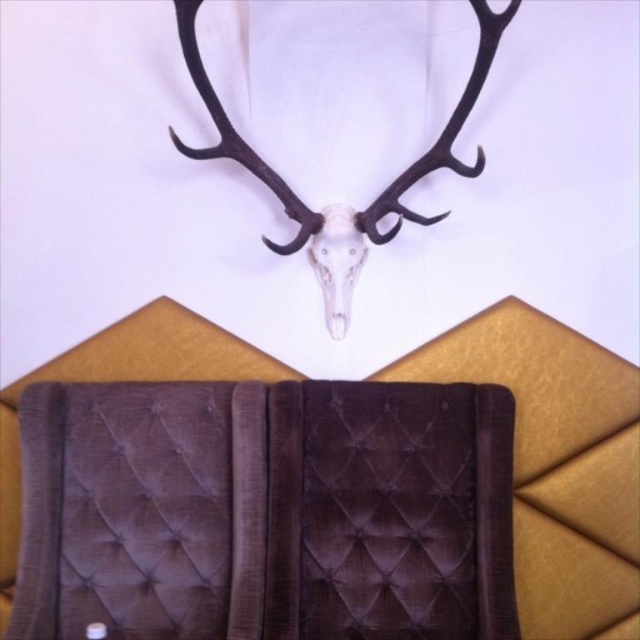
Is black matte antler at upper center above white matte skull at center?

Correct, black matte antler at upper center is located above white matte skull at center.

Which is in front, point (310, 228) or point (333, 202)?

Point (310, 228) is more forward.

This screenshot has height=640, width=640. Find the location of `black matte antler at upper center`. black matte antler at upper center is located at coordinates (442, 132).